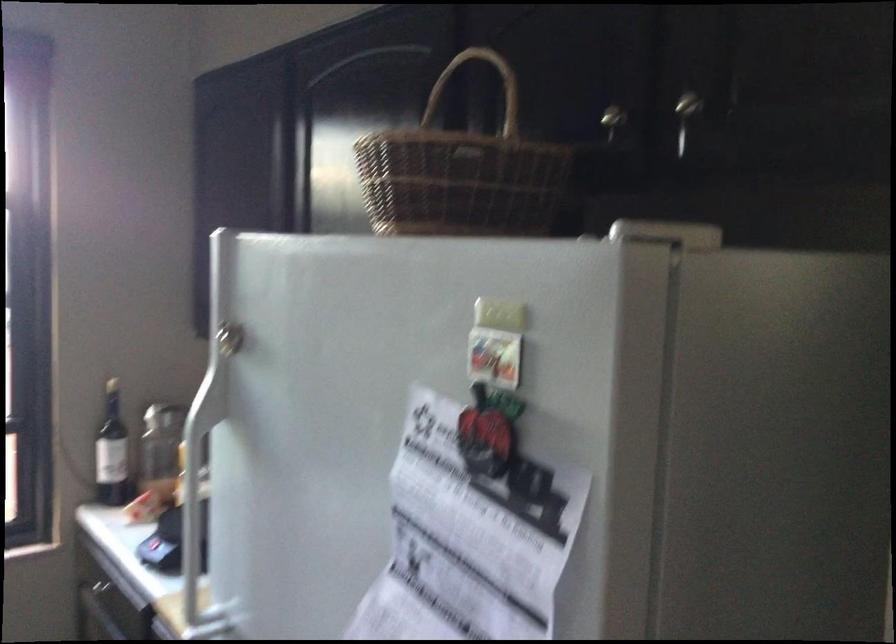
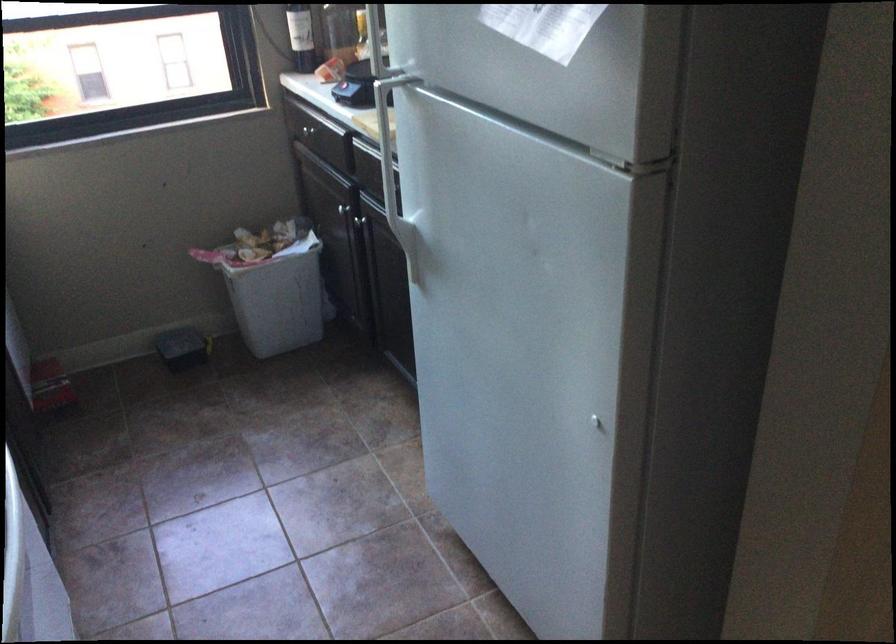
Find the pixel in the second image that matches [104,478] in the first image.

(300, 37)